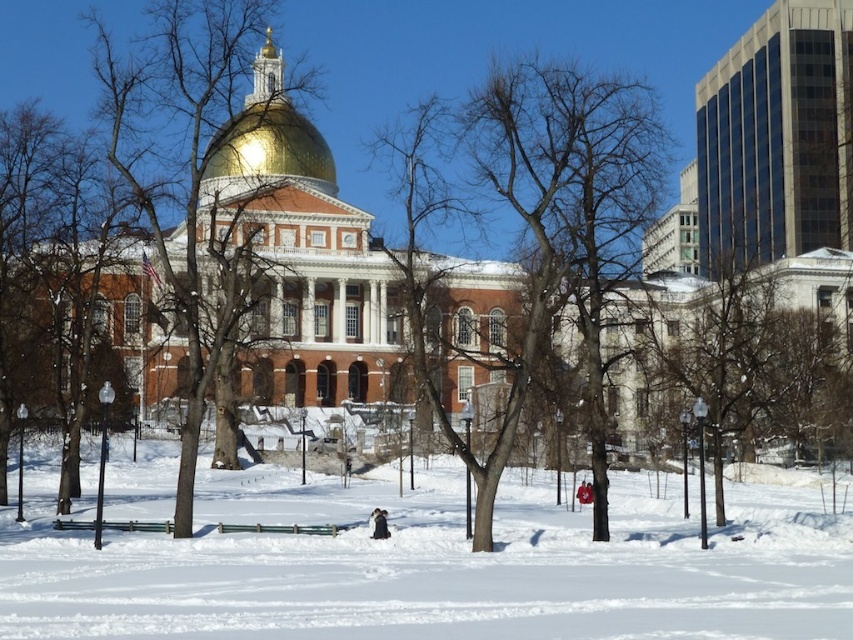
Which is in front, point (584, 84) or point (314, 180)?

Point (584, 84)

Does bare wood tree at center have a greater width compared to gold metallic dome at center?

Indeed, bare wood tree at center has a greater width compared to gold metallic dome at center.

This screenshot has height=640, width=853. I want to click on bare wood tree at center, so click(x=552, y=212).

Between point (358, 538) and point (148, 112), which one is positioned behind?

The point (148, 112) is behind.

Who is lower down, white powdery snow at center or brown bark tree at center?

white powdery snow at center is below.

Does point (589, 627) come closer to viewer compared to point (164, 113)?

Yes.

Image resolution: width=853 pixels, height=640 pixels. Find the location of `white powdery snow at center`. white powdery snow at center is located at coordinates (434, 566).

Between white powdery snow at center and bare wood tree at center, which one has less height?

white powdery snow at center

In the scene shown: Is white powdery snow at center taller than bare wood tree at center?

No.

Find the location of a particular element. The height and width of the screenshot is (640, 853). white powdery snow at center is located at coordinates (434, 566).